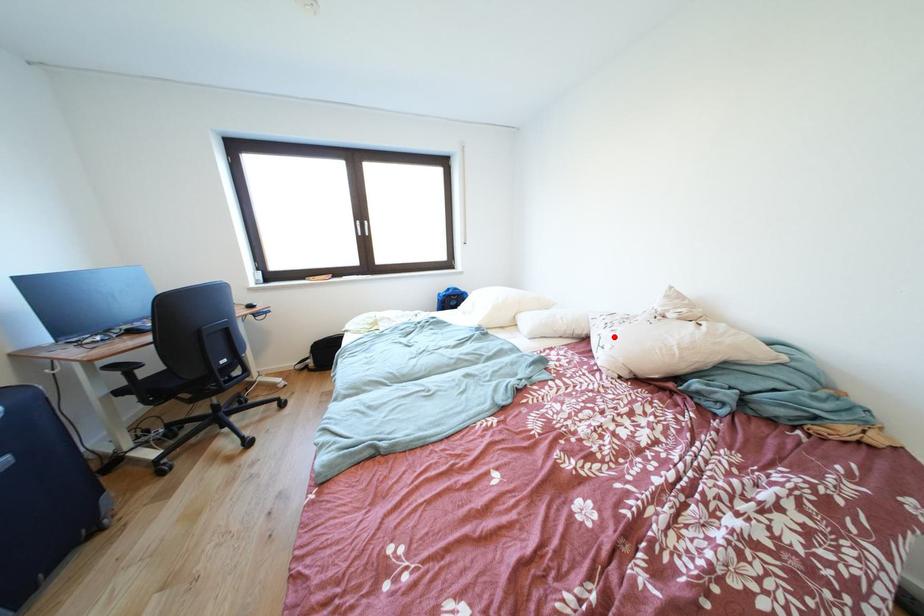
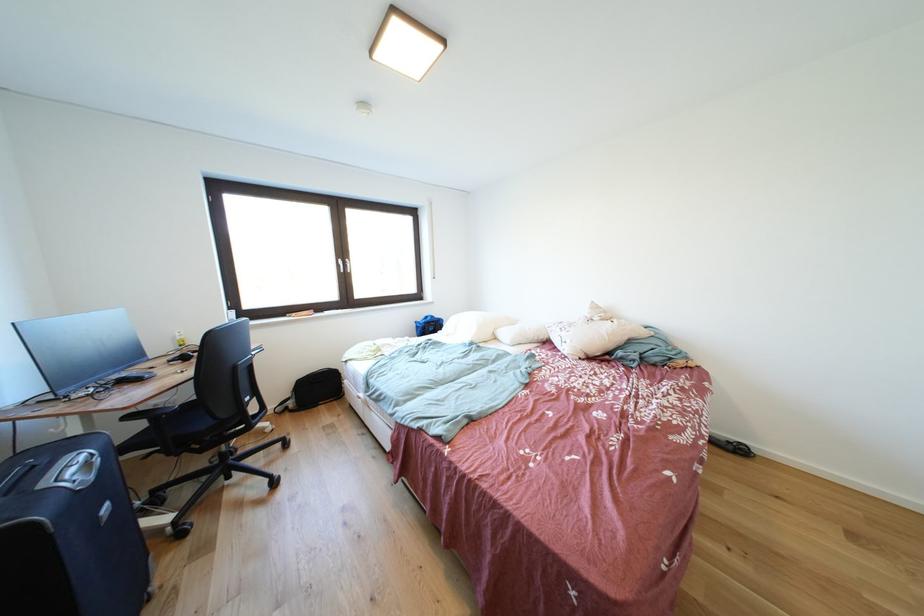
Find the pixel in the second image that matches the highlighted location in the first image.

(572, 338)